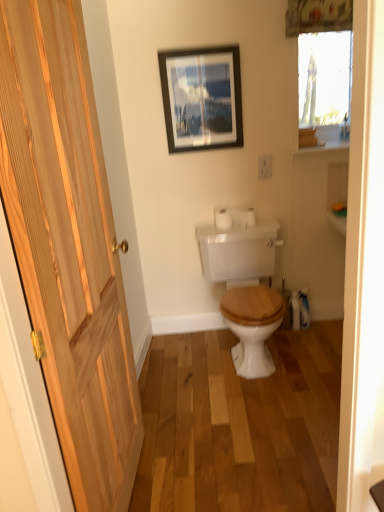
Describe the element at coordinates (234, 217) in the screenshot. I see `white matte toilet paper at center` at that location.

In order to face white glossy toilet at center, should I rotate leftwards or rightwards?

To align with it, rotate right about 7.274°.

Where is `floral fabric curtain at upper center`? The height and width of the screenshot is (512, 384). floral fabric curtain at upper center is located at coordinates (318, 16).

Describe the element at coordinates (318, 16) in the screenshot. I see `floral fabric curtain at upper center` at that location.

Where is `white matte toilet paper at center`? The height and width of the screenshot is (512, 384). white matte toilet paper at center is located at coordinates (234, 217).

In the scene shown: Considering the relative positions of white glossy toilet at center and natural wood door at left in the image provided, is white glossy toilet at center to the right of natural wood door at left from the viewer's perspective?

Yes.

Does white glossy toilet at center have a greater height compared to natural wood door at left?

No.

Which is closer, (241, 273) or (112, 276)?

Point (241, 273) appears to be farther away from the viewer than point (112, 276).

Would you say white glossy toilet at center is a long distance from natural wood door at left?

white glossy toilet at center is far away from natural wood door at left.

Is white matte toilet paper at center inside the boundaries of matte black picture frame at upper center, or outside?

white matte toilet paper at center exists outside the volume of matte black picture frame at upper center.

Is white matte toilet paper at center bigger than matte black picture frame at upper center?

No.

Is white matte toilet paper at center far away from matte black picture frame at upper center?

No, white matte toilet paper at center is in close proximity to matte black picture frame at upper center.

In the scene shown: Are white glossy toilet at center and white matte toilet paper at center making contact?

No, white glossy toilet at center is not with white matte toilet paper at center.

Considering the relative positions of white glossy toilet at center and white matte toilet paper at center in the image provided, is white glossy toilet at center to the left of white matte toilet paper at center from the viewer's perspective?

No, white glossy toilet at center is not to the left of white matte toilet paper at center.

Consider the image. From the image's perspective, is white glossy toilet at center beneath white matte toilet paper at center?

Indeed, from the image's perspective, white glossy toilet at center is shown beneath white matte toilet paper at center.

Is white glossy toilet at center positioned before white matte toilet paper at center?

Yes, white glossy toilet at center is in front of white matte toilet paper at center.

How distant is white glossy toilet at center from matte black picture frame at upper center?

white glossy toilet at center and matte black picture frame at upper center are 32.60 inches apart.

Does white glossy toilet at center have a lesser height compared to matte black picture frame at upper center?

No.

Is point (273, 251) positioned behind point (191, 141)?

Yes.

Is floral fabric curtain at upper center oriented towards matte black picture frame at upper center?

No.

Is floral fabric curtain at upper center spatially inside matte black picture frame at upper center, or outside of it?

floral fabric curtain at upper center is not inside matte black picture frame at upper center, it's outside.

Is floral fabric curtain at upper center bigger than matte black picture frame at upper center?

Actually, floral fabric curtain at upper center might be smaller than matte black picture frame at upper center.

Consider the image. Considering their positions, is matte black picture frame at upper center located in front of or behind white matte toilet paper at center?

In the image, matte black picture frame at upper center appears in front of white matte toilet paper at center.

Would you say white matte toilet paper at center is part of matte black picture frame at upper center's contents?

Definitely not — white matte toilet paper at center is not inside matte black picture frame at upper center.

Is matte black picture frame at upper center taller than white matte toilet paper at center?

Correct, matte black picture frame at upper center is much taller as white matte toilet paper at center.

Does matte black picture frame at upper center have a greater width compared to white matte toilet paper at center?

In fact, matte black picture frame at upper center might be narrower than white matte toilet paper at center.

I want to click on picture frame behind the floral fabric curtain at upper center, so click(x=202, y=98).

Is matte black picture frame at upper center further to camera compared to floral fabric curtain at upper center?

Yes.

From the image's perspective, which one is positioned lower, matte black picture frame at upper center or floral fabric curtain at upper center?

matte black picture frame at upper center.

Where is `door in front of the white glossy toilet at center`? This screenshot has height=512, width=384. door in front of the white glossy toilet at center is located at coordinates (68, 246).

Image resolution: width=384 pixels, height=512 pixels. In the image, there is a matte black picture frame at upper center. Identify the location of toilet paper below it (from a real-world perspective). click(234, 217).

When comparing their distances from natural wood door at left, does white glossy toilet at center or matte black picture frame at upper center seem further?

matte black picture frame at upper center is further to natural wood door at left.

Estimate the real-world distances between objects in this image. Which object is closer to white matte toilet paper at center, matte black picture frame at upper center or natural wood door at left?

matte black picture frame at upper center is closer to white matte toilet paper at center.

Based on their spatial positions, is white matte toilet paper at center or natural wood door at left closer to matte black picture frame at upper center?

white matte toilet paper at center is closer to matte black picture frame at upper center.

From the image, which object appears to be nearer to natural wood door at left, white matte toilet paper at center or white glossy toilet at center?

white glossy toilet at center is positioned closer to the anchor natural wood door at left.

Looking at the image, which one is located further to floral fabric curtain at upper center, white glossy toilet at center or matte black picture frame at upper center?

white glossy toilet at center lies further to floral fabric curtain at upper center than the other object.

Based on their spatial positions, is matte black picture frame at upper center or white matte toilet paper at center closer to natural wood door at left?

Among the two, matte black picture frame at upper center is located nearer to natural wood door at left.

Looking at the image, which one is located closer to natural wood door at left, floral fabric curtain at upper center or white glossy toilet at center?

Among the two, white glossy toilet at center is located nearer to natural wood door at left.

Looking at this image, considering their positions, is white glossy toilet at center positioned further to white matte toilet paper at center than natural wood door at left?

natural wood door at left lies further to white matte toilet paper at center than the other object.

The width and height of the screenshot is (384, 512). I want to click on toilet paper between matte black picture frame at upper center and white glossy toilet at center vertically, so click(x=234, y=217).

Identify the location of picture frame located between natural wood door at left and white matte toilet paper at center in the depth direction. This screenshot has height=512, width=384. (202, 98).

Where is `door between floral fabric curtain at upper center and white glossy toilet at center from top to bottom`? door between floral fabric curtain at upper center and white glossy toilet at center from top to bottom is located at coordinates (68, 246).

Find the location of a particular element. curtain between natural wood door at left and white matte toilet paper at center along the z-axis is located at coordinates click(x=318, y=16).